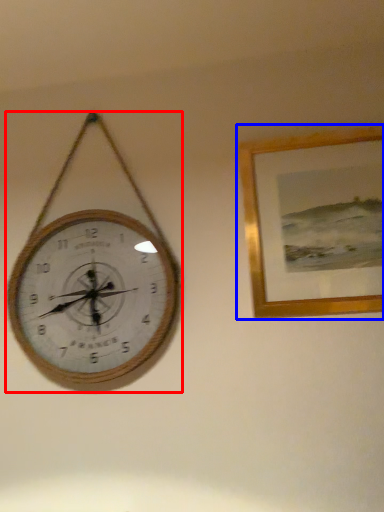
Question: Which object appears closest to the camera in this image, wall clock (highlighted by a red box) or picture frame (highlighted by a blue box)?

Choices:
 (A) wall clock
 (B) picture frame

Answer: (B)